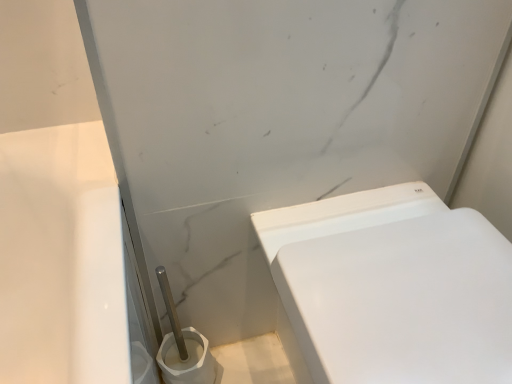
This screenshot has height=384, width=512. Describe the element at coordinates (393, 287) in the screenshot. I see `white glossy toilet at center` at that location.

Locate an element on the screen. Image resolution: width=512 pixels, height=384 pixels. white glossy toilet at center is located at coordinates (393, 287).

The width and height of the screenshot is (512, 384). Identify the location of white glossy toilet at center. (393, 287).